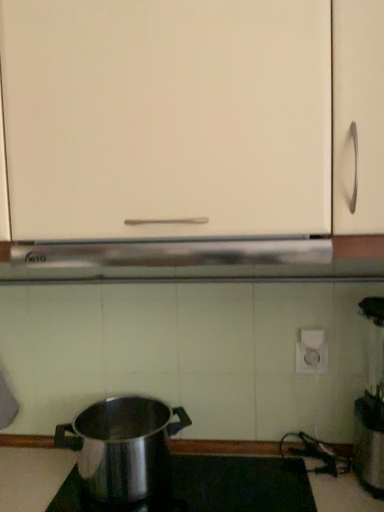
At what (x,y) coordinates should I click in order to perform the action: click on polished stainless steel pot at lower center. Please return your answer as a coordinate pair (x, y). Image resolution: width=384 pixels, height=512 pixels. Looking at the image, I should click on (208, 488).

Find the location of `polished stainless steel pot at lower left`. polished stainless steel pot at lower left is located at coordinates (123, 449).

Image resolution: width=384 pixels, height=512 pixels. Identify the location of white matte cabinet at center. (167, 117).

At what (x,y) coordinates should I click in order to perform the action: click on polished stainless steel pot at lower center. Please return your answer as a coordinate pair (x, y). Image resolution: width=384 pixels, height=512 pixels. Looking at the image, I should click on (208, 488).

Is polished stainless steel pot at lower left positioned far away from polished stainless steel pot at lower center?

No, there isn't a large distance between polished stainless steel pot at lower left and polished stainless steel pot at lower center.

Could you tell me if polished stainless steel pot at lower left is turned towards polished stainless steel pot at lower center?

No, polished stainless steel pot at lower left is not facing towards polished stainless steel pot at lower center.

Based on the photo, is polished stainless steel pot at lower left wider or thinner than polished stainless steel pot at lower center?

Clearly, polished stainless steel pot at lower left has less width compared to polished stainless steel pot at lower center.

Are polished stainless steel pot at lower center and polished stainless steel pot at lower left far apart?

Actually, polished stainless steel pot at lower center and polished stainless steel pot at lower left are a little close together.

From the image's perspective, which is below, polished stainless steel pot at lower center or polished stainless steel pot at lower left?

polished stainless steel pot at lower center, from the image's perspective.

Looking at the image, does polished stainless steel pot at lower center seem bigger or smaller compared to polished stainless steel pot at lower left?

Considering their sizes, polished stainless steel pot at lower center takes up less space than polished stainless steel pot at lower left.

From a real-world perspective, who is located lower, polished stainless steel pot at lower center or polished stainless steel pot at lower left?

In real-world perspective, polished stainless steel pot at lower center is lower.

Which of these two, polished stainless steel pot at lower left or white matte cabinet at center, stands shorter?

polished stainless steel pot at lower left.

In order to click on kitchen appliance located below the white matte cabinet at center (from the image's perspective) in this screenshot , I will do `click(123, 449)`.

Is polished stainless steel pot at lower left beside white matte cabinet at center?

No, polished stainless steel pot at lower left is not making contact with white matte cabinet at center.

Can you tell me how much polished stainless steel pot at lower left and white matte cabinet at center differ in facing direction?

They differ by 0.143 degrees in their facing directions.

Considering the points (92, 506) and (282, 223), which point is behind, point (92, 506) or point (282, 223)?

The point (92, 506) is farther from the camera.

In the image, is polished stainless steel pot at lower center positioned in front of or behind white matte cabinet at center?

In the image, polished stainless steel pot at lower center appears behind white matte cabinet at center.

How many degrees apart are the facing directions of polished stainless steel pot at lower center and white matte cabinet at center?

The angle between the facing direction of polished stainless steel pot at lower center and the facing direction of white matte cabinet at center is 0.619 degrees.

Is polished stainless steel pot at lower center located outside white matte cabinet at center?

Absolutely, polished stainless steel pot at lower center is external to white matte cabinet at center.

Locate an element on the screen. This screenshot has width=384, height=512. kitchen appliance below the white matte cabinet at center (from the image's perspective) is located at coordinates (123, 449).

Is white matte cabinet at center inside or outside of polished stainless steel pot at lower left?

white matte cabinet at center exists outside the volume of polished stainless steel pot at lower left.

Which object is further away from the camera, white matte cabinet at center or polished stainless steel pot at lower left?

Positioned behind is polished stainless steel pot at lower left.

Is point (300, 178) closer to camera compared to point (151, 470)?

Yes, point (300, 178) is closer to viewer.

Between white matte cabinet at center and polished stainless steel pot at lower center, which one has larger width?

With larger width is white matte cabinet at center.

Is the depth of white matte cabinet at center less than that of polished stainless steel pot at lower center?

That is True.

Is white matte cabinet at center not close to polished stainless steel pot at lower center?

No, white matte cabinet at center is not far from polished stainless steel pot at lower center.

From a real-world perspective, is white matte cabinet at center physically located above or below polished stainless steel pot at lower center?

From a real-world perspective, white matte cabinet at center is physically above polished stainless steel pot at lower center.

Find the location of a particular element. The image size is (384, 512). gas stove below the polished stainless steel pot at lower left (from a real-world perspective) is located at coordinates (208, 488).

This screenshot has width=384, height=512. What are the coordinates of `kitchen appliance lying above the polished stainless steel pot at lower center (from the image's perspective)` in the screenshot? It's located at (123, 449).

Estimate the real-world distances between objects in this image. Which object is closer to polished stainless steel pot at lower left, white matte cabinet at center or polished stainless steel pot at lower center?

polished stainless steel pot at lower center is positioned closer to the anchor polished stainless steel pot at lower left.

From the picture: When comparing their distances from polished stainless steel pot at lower center, does polished stainless steel pot at lower left or white matte cabinet at center seem closer?

Based on the image, polished stainless steel pot at lower left appears to be nearer to polished stainless steel pot at lower center.

Looking at the image, which one is located closer to polished stainless steel pot at lower center, white matte cabinet at center or polished stainless steel pot at lower left?

The object closer to polished stainless steel pot at lower center is polished stainless steel pot at lower left.

Based on the photo, from the image, which object appears to be farther from white matte cabinet at center, polished stainless steel pot at lower left or polished stainless steel pot at lower center?

polished stainless steel pot at lower center is further to white matte cabinet at center.

Considering their positions, is polished stainless steel pot at lower center positioned closer to polished stainless steel pot at lower left than white matte cabinet at center?

polished stainless steel pot at lower center lies closer to polished stainless steel pot at lower left than the other object.

Which object lies further to the anchor point white matte cabinet at center, polished stainless steel pot at lower center or polished stainless steel pot at lower left?

polished stainless steel pot at lower center.

Locate an element on the screen. kitchen appliance that lies between white matte cabinet at center and polished stainless steel pot at lower center from top to bottom is located at coordinates (123, 449).